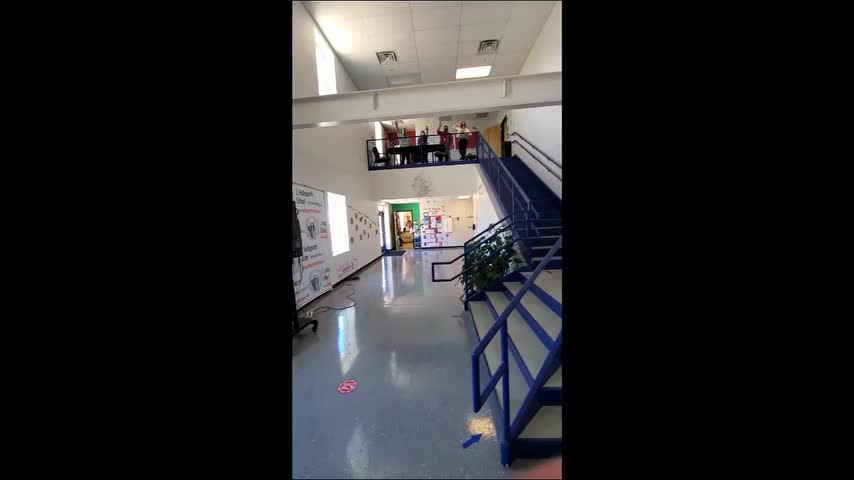
This screenshot has height=480, width=854. In order to click on wall in this screenshot , I will do `click(558, 50)`, `click(552, 118)`, `click(320, 149)`, `click(305, 76)`.